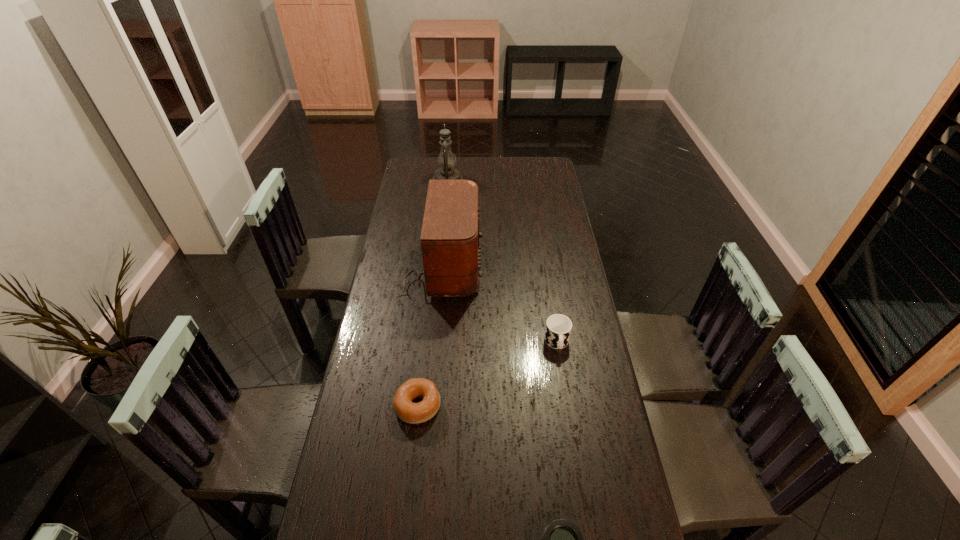
Find the location of a particular element. free region at the left edge of the desktop is located at coordinates pyautogui.click(x=363, y=383).

In the image, there is a desktop. At what (x,y) coordinates should I click in order to perform the action: click on free space at the right edge. Please return your answer as a coordinate pair (x, y). This screenshot has height=540, width=960. Looking at the image, I should click on (584, 448).

You are a GUI agent. You are given a task and a screenshot of the screen. Output one action in this format:
    pyautogui.click(x=<x>, y=<y>)
    Task: Click on the vacant area between the nearest yellow sunflower and the biggest yellow sunflower
    
    Given the screenshot: What is the action you would take?
    pyautogui.click(x=516, y=269)

Locate an element on the screen. The image size is (960, 540). free space between the third sunflower from right to left and the carton is located at coordinates (517, 195).

You are a GUI agent. You are given a task and a screenshot of the screen. Output one action in this format:
    pyautogui.click(x=<x>, y=<y>)
    Task: Click on the vacant area that lies between the carton and the leftmost yellow sunflower
    
    Given the screenshot: What is the action you would take?
    pyautogui.click(x=517, y=195)

The height and width of the screenshot is (540, 960). Find the location of `vacant point located between the second smallest green sunflower and the carton`. vacant point located between the second smallest green sunflower and the carton is located at coordinates (484, 261).

The width and height of the screenshot is (960, 540). Identify the location of empty location between the smallest yellow sunflower and the nearest green sunflower. (504, 362).

Identify the location of vacant space in between the red fire extinguisher and the smallest yellow sunflower. This screenshot has width=960, height=540. (522, 204).

You are a GUI agent. You are given a task and a screenshot of the screen. Output one action in this format:
    pyautogui.click(x=<x>, y=<y>)
    Task: Click on the free space between the fifth farthest sunflower and the biggest yellow sunflower
    
    Given the screenshot: What is the action you would take?
    pyautogui.click(x=455, y=287)

The height and width of the screenshot is (540, 960). I want to click on the fifth closest object to the third nearest sunflower, so click(491, 103).